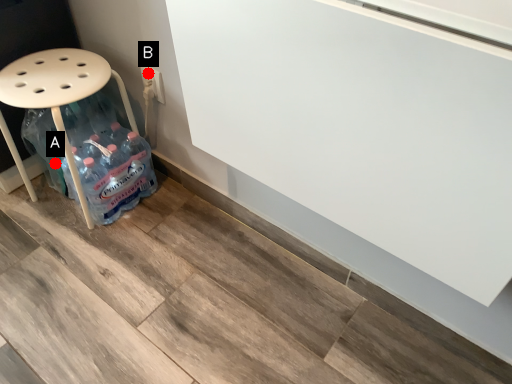
Question: Two points are circled on the image, labeled by A and B beside each circle. Which point appears closest to the camera in this image?

Choices:
 (A) A is closer
 (B) B is closer

Answer: (B)